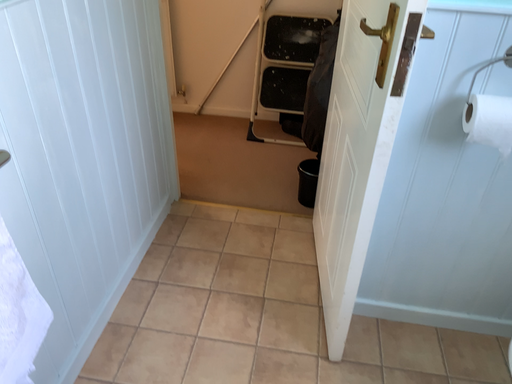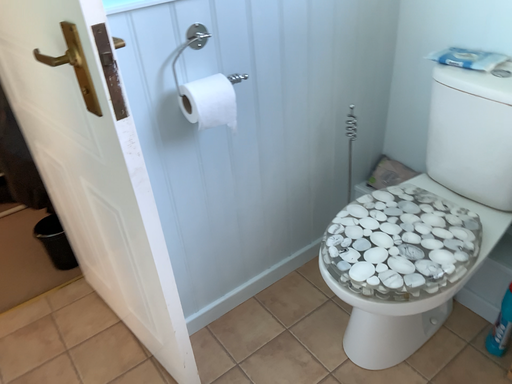
Question: Which way did the camera rotate in the video?

Choices:
 (A) rotated right
 (B) rotated left

Answer: (A)